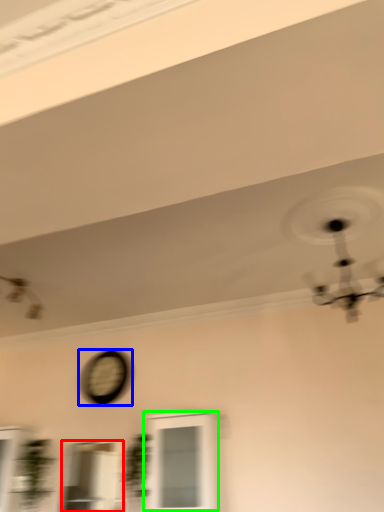
Question: Based on their relative distances, which object is nearer to window (highlighted by a red box)? Choose from clock (highlighted by a blue box) and window (highlighted by a green box).

Choices:
 (A) clock
 (B) window

Answer: (A)